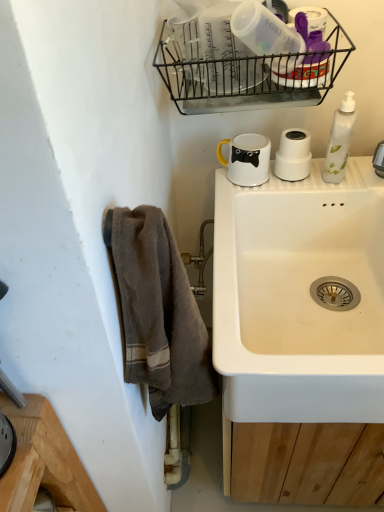
This screenshot has height=512, width=384. I want to click on unoccupied region to the right of white matte cup at upper right, the 1th appliance when ordered from right to left, so click(x=342, y=173).